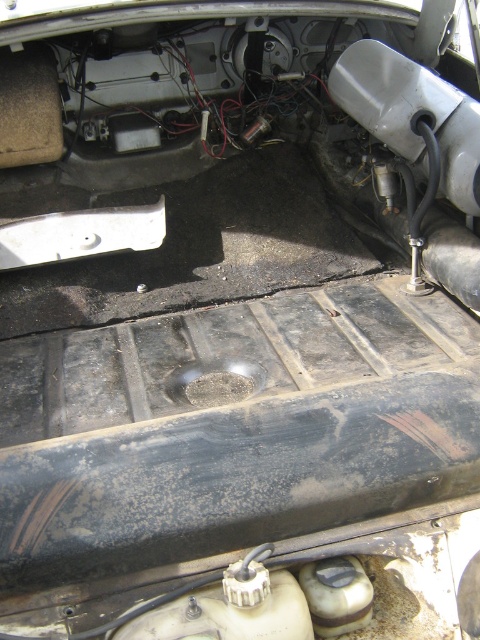
Question: Among these objects, which one is nearest to the camera?

Choices:
 (A) white matte bumper at center
 (B) matte plastic bumper at upper center

Answer: (B)

Question: From the image, what is the correct spatial relationship of matte plastic bumper at upper center in relation to white matte bumper at center?

Choices:
 (A) left
 (B) right

Answer: (B)

Question: From the image, what is the correct spatial relationship of matte plastic bumper at upper center in relation to white matte bumper at center?

Choices:
 (A) right
 (B) left

Answer: (A)

Question: Which point is farther to the camera?

Choices:
 (A) (156, 221)
 (B) (451, 100)

Answer: (A)

Question: Is matte plastic bumper at upper center above white matte bumper at center?

Choices:
 (A) yes
 (B) no

Answer: (A)